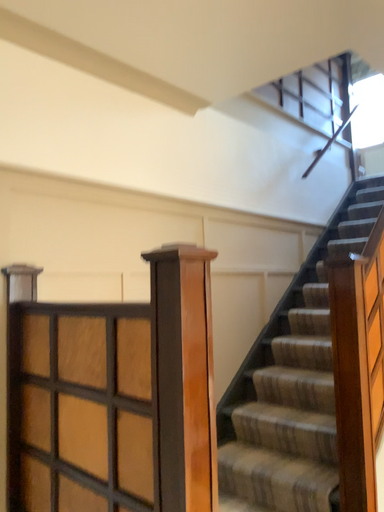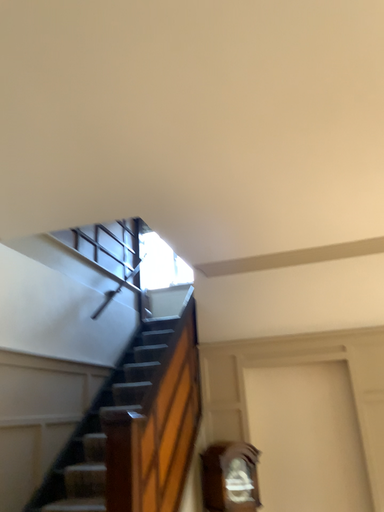
Question: How did the camera likely rotate when shooting the video?

Choices:
 (A) rotated left
 (B) rotated right

Answer: (B)